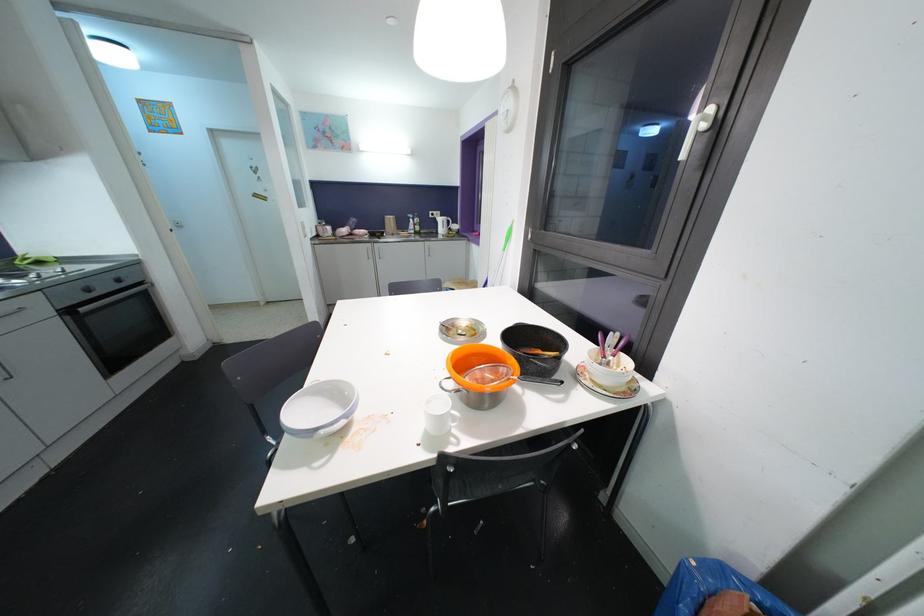
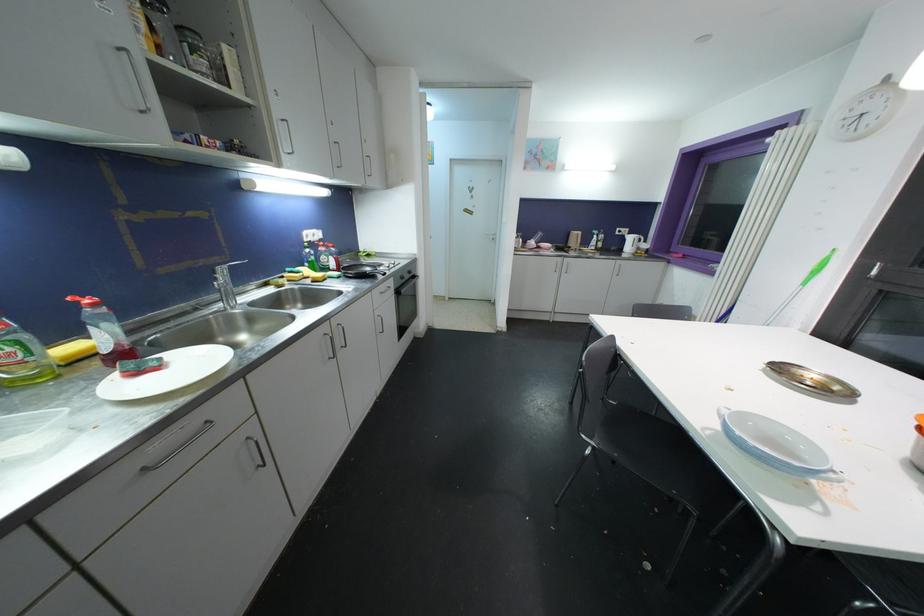
The point at [70,314] is marked in the first image. Where is the corresponding point in the second image?

(400, 294)